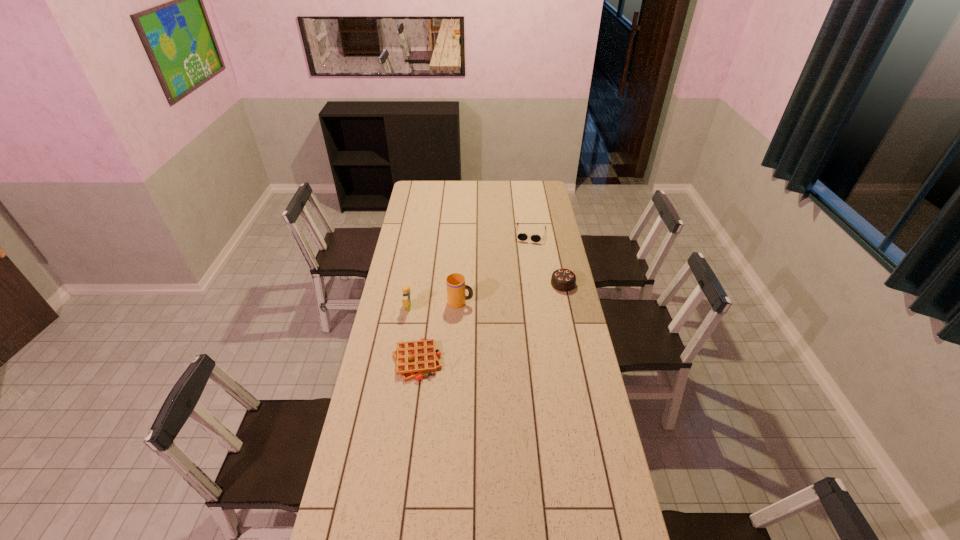
The width and height of the screenshot is (960, 540). Identify the location of vacant area that lies between the sunglasses and the shortest object. (473, 297).

Where is `free point between the nearest object and the sunglasses`? Image resolution: width=960 pixels, height=540 pixels. free point between the nearest object and the sunglasses is located at coordinates (473, 297).

Find the location of `vacant area that lies between the third tallest object and the farthest object`. vacant area that lies between the third tallest object and the farthest object is located at coordinates (546, 259).

At what (x,y) coordinates should I click in order to perform the action: click on vacant region between the nearest object and the Lego. Please return your answer as a coordinate pair (x, y). This screenshot has height=540, width=960. Looking at the image, I should click on point(413,334).

At what (x,y) coordinates should I click in order to perform the action: click on free space between the chocolate cake and the sunglasses. Please return your answer as a coordinate pair (x, y). Looking at the image, I should click on (546, 259).

The width and height of the screenshot is (960, 540). I want to click on vacant space that is in between the fourth tallest object and the chocolate cake, so click(x=546, y=259).

Identify the location of free space between the shortest object and the third shortest object. This screenshot has width=960, height=540. (490, 322).

You are a GUI agent. You are given a task and a screenshot of the screen. Output one action in this format:
    pyautogui.click(x=<x>, y=<y>)
    Task: Click on the blank region between the cup and the fourth shortest object
    This screenshot has height=540, width=960.
    Given the screenshot: What is the action you would take?
    pyautogui.click(x=434, y=305)

Identify the location of empty location between the farthest object and the Lego. pos(469,271).

Select which object appears as the third closest to the fourth nearest object. Please provide its 2D coordinates. Your answer should be formatted as a tuple, i.e. [(x, y)], where the tuple contains the x and y coordinates of a point satisfying the conditions above.

[(413, 359)]